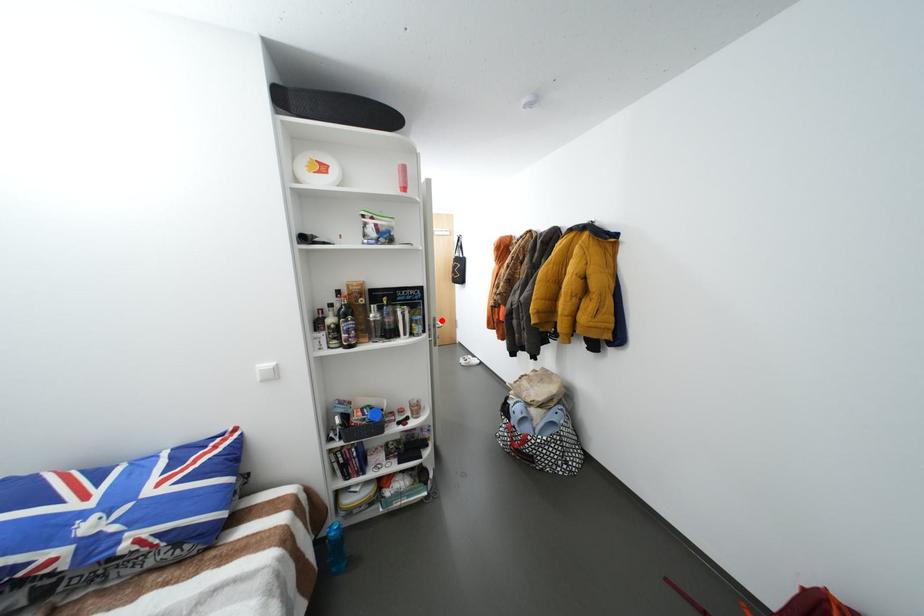
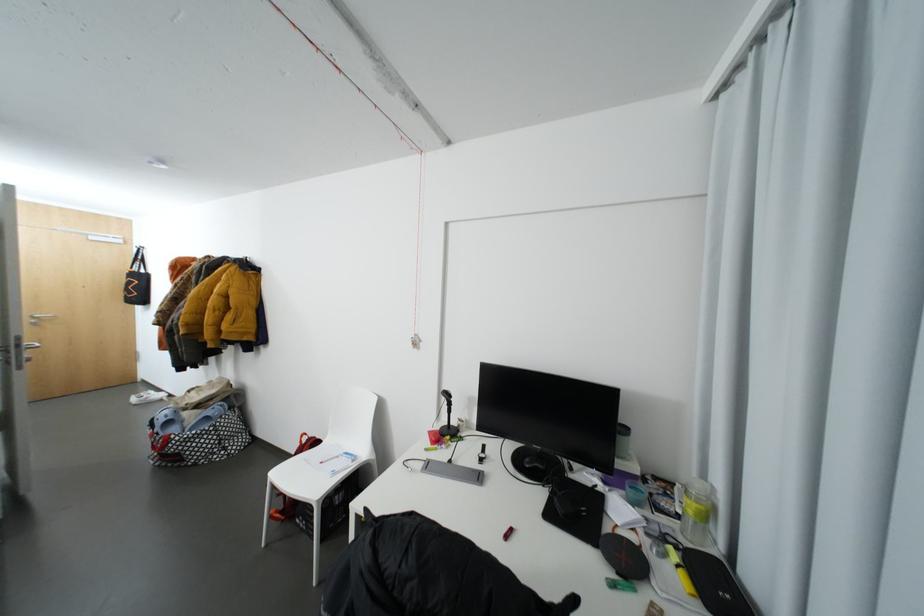
The point at the highlighted location is marked in the first image. Where is the corresponding point in the second image?

(26, 339)